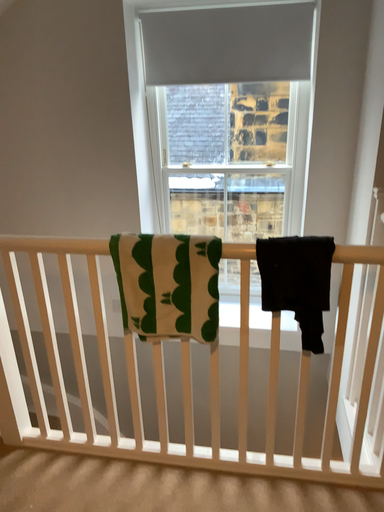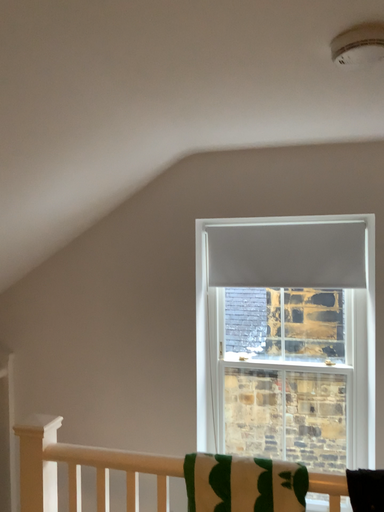
Question: How did the camera likely rotate when shooting the video?

Choices:
 (A) rotated downward
 (B) rotated upward

Answer: (B)